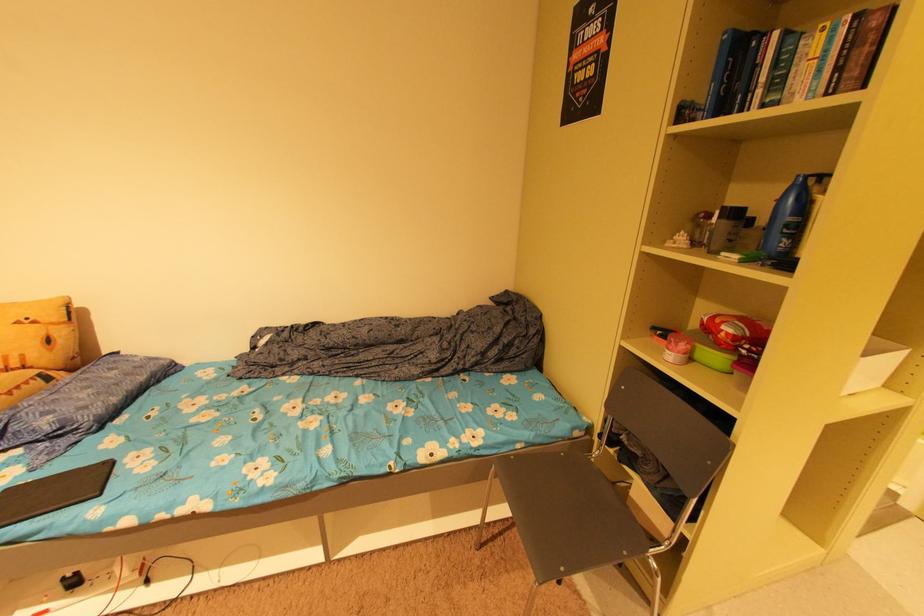
I want to click on black tablet case, so click(54, 492).